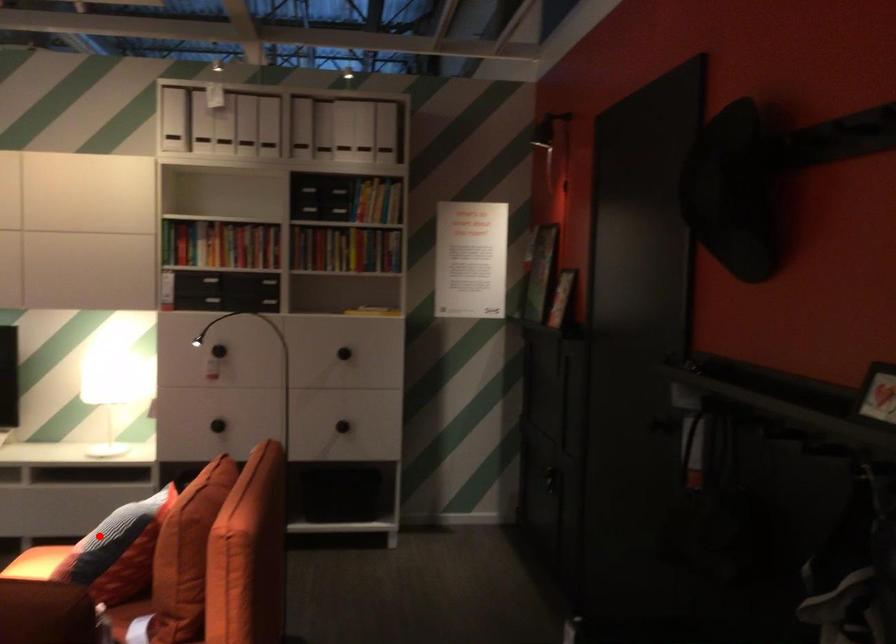
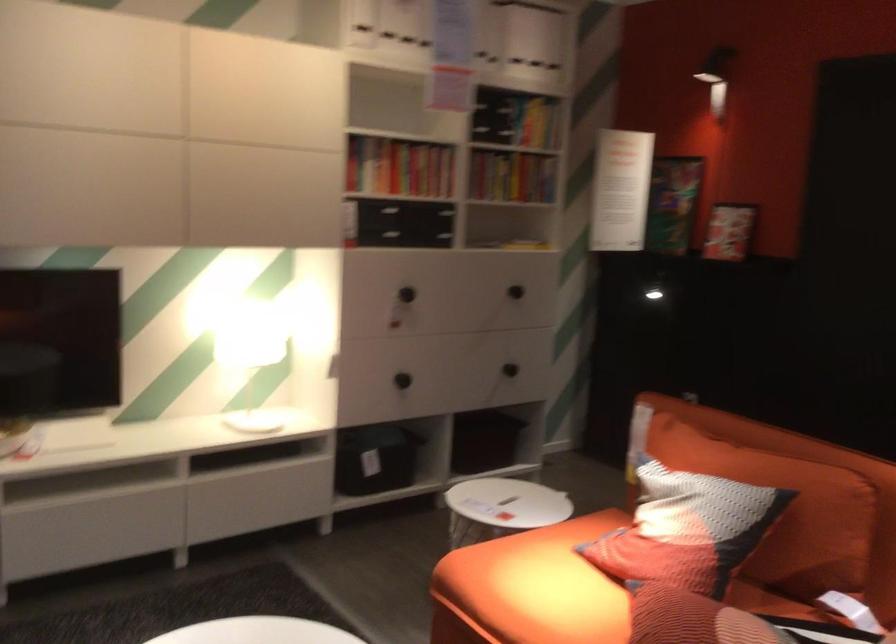
Question: I am providing you with two images of the same scene from different viewpoints. Given a red point in image1, look at the same physical point in image2. Is it:

Choices:
 (A) Closer to the viewpoint
 (B) Farther from the viewpoint

Answer: (A)